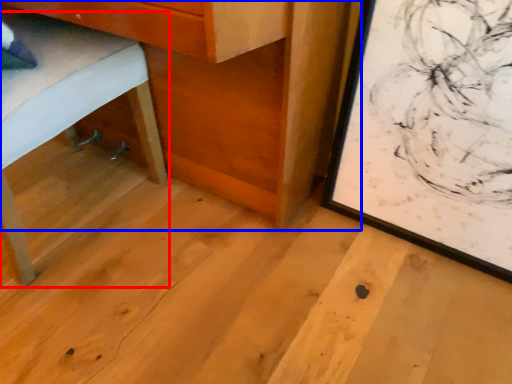
Question: Which point is closer to the camera, furniture (highlighted by a red box) or table (highlighted by a blue box)?

Choices:
 (A) furniture
 (B) table

Answer: (A)